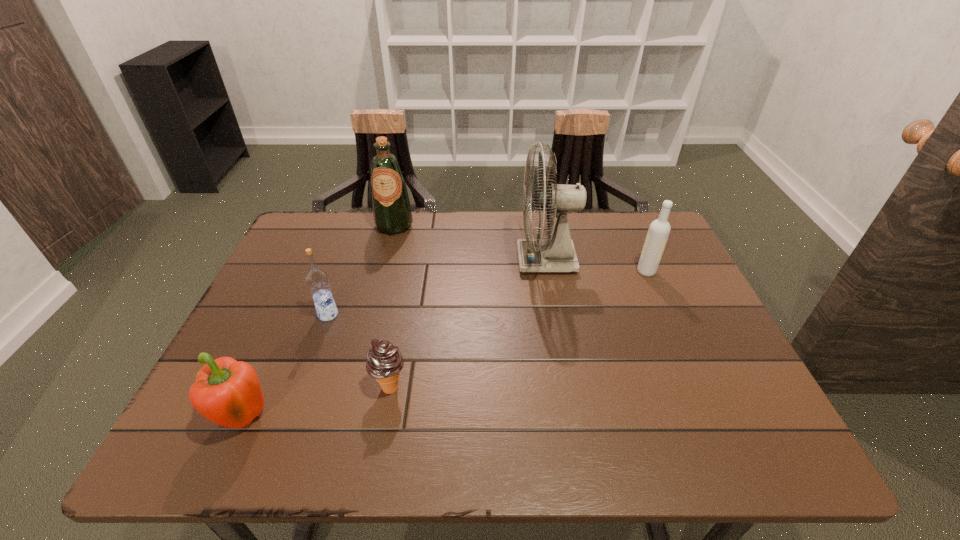
At what (x,y) coordinates should I click in order to perform the action: click on object at the left edge. Please return your answer as a coordinate pair (x, y). This screenshot has width=960, height=540. Looking at the image, I should click on (227, 392).

At what (x,y) coordinates should I click in order to perform the action: click on object located in the right edge section of the desktop. Please return your answer as a coordinate pair (x, y). Looking at the image, I should click on (659, 230).

Find the location of a particular element. The width and height of the screenshot is (960, 540). object that is at the near left corner is located at coordinates (227, 392).

Where is `free region at the far edge of the desktop`? Image resolution: width=960 pixels, height=540 pixels. free region at the far edge of the desktop is located at coordinates (576, 240).

In the image, there is a desktop. Where is `vacant region at the near edge`? The image size is (960, 540). vacant region at the near edge is located at coordinates (667, 428).

In the image, there is a desktop. Where is `vacant space at the right edge`? vacant space at the right edge is located at coordinates (684, 271).

This screenshot has width=960, height=540. Find the location of `vacant area at the far left corner of the desktop`. vacant area at the far left corner of the desktop is located at coordinates (328, 247).

The height and width of the screenshot is (540, 960). Identify the location of vacant space at the far right corner of the desktop. (633, 230).

Locate an element on the screen. This screenshot has width=960, height=540. free spot at the near right corner of the desktop is located at coordinates (777, 461).

You are a GUI agent. You are given a task and a screenshot of the screen. Output one action in this format:
    pyautogui.click(x=<x>, y=<y>)
    Task: Click on the unoccupied position between the pepper and the fan
    
    Given the screenshot: What is the action you would take?
    pyautogui.click(x=396, y=340)